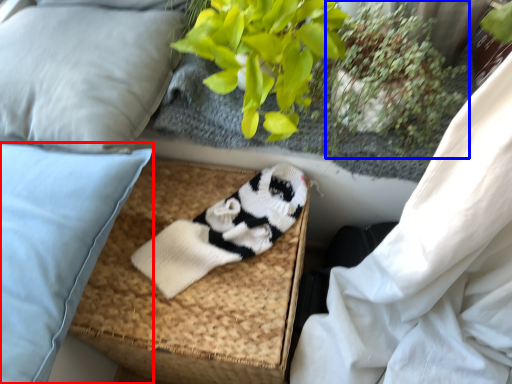
Question: Which object appears closest to the camera in this image, pillow (highlighted by a red box) or plant (highlighted by a blue box)?

Choices:
 (A) pillow
 (B) plant

Answer: (A)